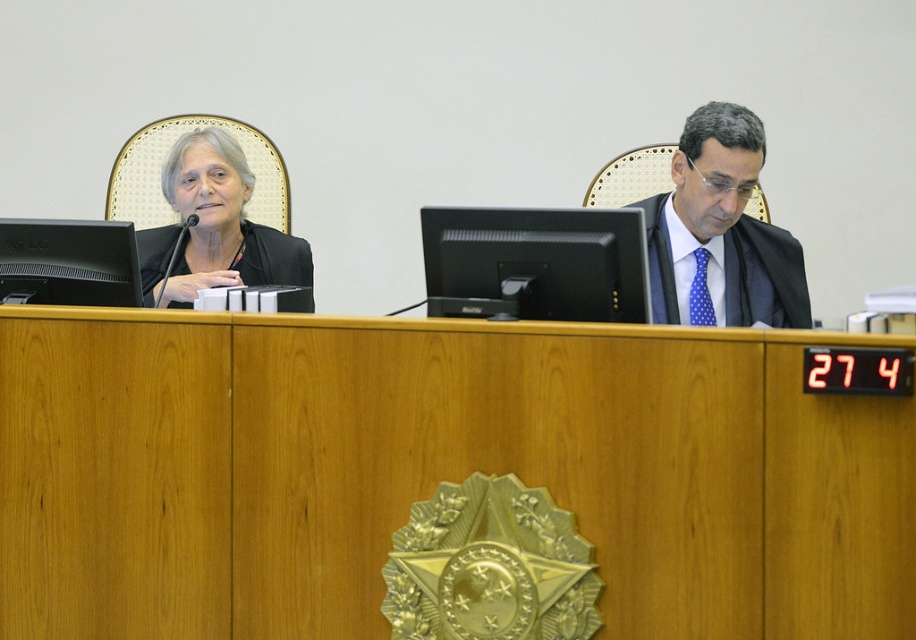
Question: Which of the following is the farthest from the observer?

Choices:
 (A) (34, 269)
 (B) (246, 269)
 (C) (2, 630)
 (D) (265, 259)

Answer: (D)

Question: Considering the real-world distances, which object is farthest from the black matte monitor at left?

Choices:
 (A) black glossy monitor at center
 (B) wooden table at center
 (C) black matte business suit at left

Answer: (A)

Question: Which of the following is the closest to the observer?

Choices:
 (A) polka dot tie at center
 (B) black matte monitor at left
 (C) wooden table at center
 (D) matte black suit at left

Answer: (C)

Question: Can you confirm if matte black suit at left is wider than black matte business suit at left?

Choices:
 (A) no
 (B) yes

Answer: (A)

Question: In this image, where is wooden table at center located relative to black matte monitor at left?

Choices:
 (A) right
 (B) left

Answer: (A)

Question: Is black glossy monitor at center bigger than black matte monitor at left?

Choices:
 (A) yes
 (B) no

Answer: (A)